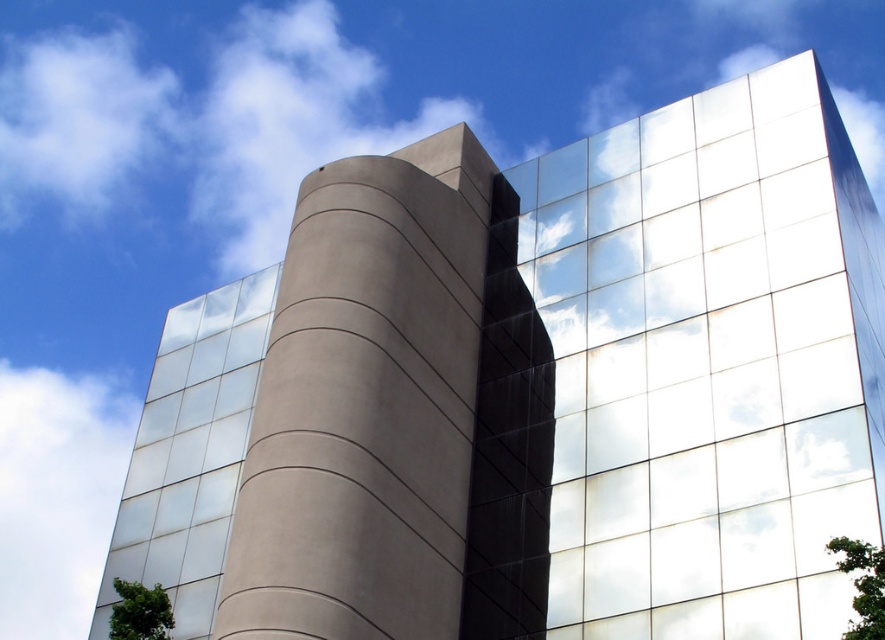
Question: Does green leafy tree at lower right appear on the right side of green leafy tree at lower left?

Choices:
 (A) no
 (B) yes

Answer: (B)

Question: Is satin glass windows at left thinner than green leafy tree at lower left?

Choices:
 (A) no
 (B) yes

Answer: (A)

Question: Estimate the real-world distances between objects in this image. Which object is closer to the white fluffy cloud at upper left?

Choices:
 (A) green leafy tree at lower right
 (B) green leafy tree at lower left

Answer: (B)

Question: Is green leafy tree at lower right positioned in front of green leafy tree at lower left?

Choices:
 (A) no
 (B) yes

Answer: (B)

Question: Which of these objects is positioned farthest from the green leafy tree at lower left?

Choices:
 (A) green leafy tree at lower right
 (B) white fluffy cloud at upper left

Answer: (B)

Question: Which of these objects is positioned closest to the green leafy tree at lower right?

Choices:
 (A) green leafy tree at lower left
 (B) white fluffy cloud at upper left

Answer: (A)